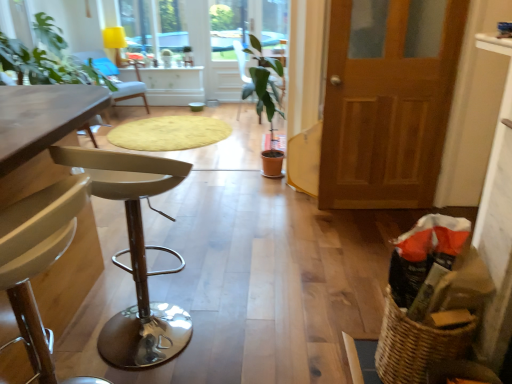
Question: Considering the relative positions of light gray fabric chair at upper left, the first chair when ordered from back to front, and transparent glass window at upper center in the image provided, is light gray fabric chair at upper left, the first chair when ordered from back to front, to the left or to the right of transparent glass window at upper center?

Choices:
 (A) left
 (B) right

Answer: (A)

Question: Is light gray fabric chair at upper left, the third chair from the front, inside or outside of transparent glass window at upper center?

Choices:
 (A) inside
 (B) outside

Answer: (B)

Question: Which is nearer to the woven brown basket at lower right?

Choices:
 (A) wooden table at left, the second table viewed from the right
 (B) wooden door at right
 (C) wooden table at left, which appears as the second table when viewed from the left
 (D) metallic silver stool at left, which appears as the first chair when viewed from the front
 (E) green matte plant at center, placed as the 1th chair when sorted from right to left

Answer: (D)

Question: Considering the real-world distances, which object is farthest from the metallic silver stool at left, the second chair when ordered from left to right?

Choices:
 (A) yellow fabric lampshade at upper center
 (B) wooden door at right
 (C) wooden table at left, the second table viewed from the right
 (D) beige textured rug at center
 (E) transparent glass window at upper center

Answer: (A)